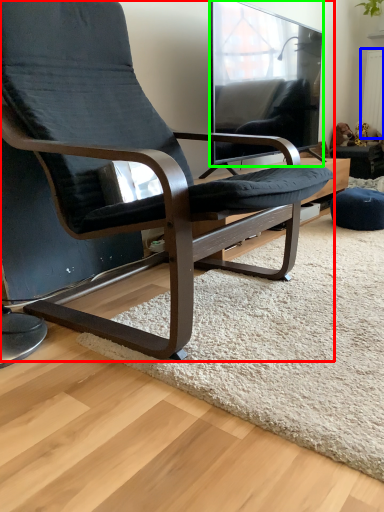
Question: Based on their relative distances, which object is nearer to chair (highlighted by a red box)? Choose from radiator (highlighted by a blue box) and window (highlighted by a green box).

Choices:
 (A) radiator
 (B) window

Answer: (B)